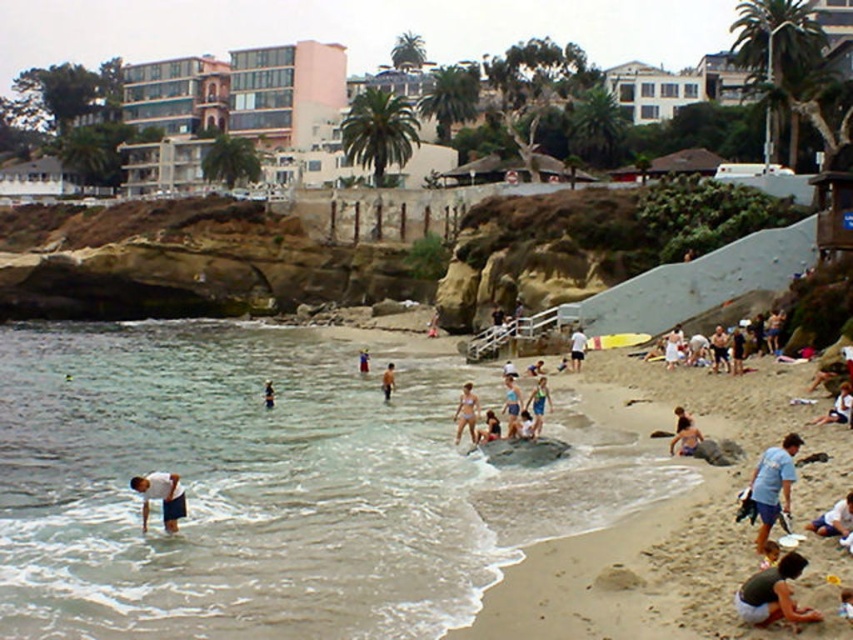
You are a person standing on the beach and want to reach the clear water at lower left without getting your white matte shorts at lower left wet. What is the minimum distance you need to move backward to stay dry?

The clear water at lower left and white matte shorts at lower left are 46.13 feet apart from each other. To avoid getting your white matte shorts at lower left wet, you need to move backward at least 46.13 feet from the water.

Based on the scene description, what is located at the coordinates point (x=265, y=486)?

The coordinates point (x=265, y=486) is occupied by clear water at lower left.

You are a person standing on the beach and want to check if your white matte shorts at lower left are fully submerged in the clear water at lower left. Based on the scene, can you determine if the water reaches above the shorts?

The clear water at lower left is taller than white matte shorts at lower left, so yes, the water reaches above the white matte shorts at lower left.